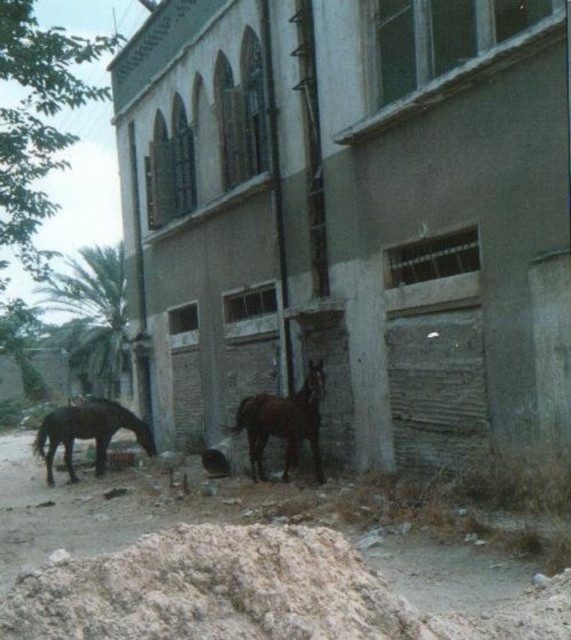
Question: Does brown glossy horse at center appear on the right side of shiny dark brown horse at lower left?

Choices:
 (A) no
 (B) yes

Answer: (B)

Question: Which object is the closest to the light brown sandy mound at lower center?

Choices:
 (A) shiny dark brown horse at lower left
 (B) brown dirt at lower center

Answer: (B)

Question: Which object is positioned closest to the shiny dark brown horse at lower left?

Choices:
 (A) brown dirt at lower center
 (B) light brown sandy mound at lower center

Answer: (A)

Question: Does light brown sandy mound at lower center come in front of brown glossy horse at center?

Choices:
 (A) yes
 (B) no

Answer: (A)

Question: Is brown dirt at lower center positioned behind shiny dark brown horse at lower left?

Choices:
 (A) yes
 (B) no

Answer: (B)

Question: Which of the following is the closest to the observer?

Choices:
 (A) shiny dark brown horse at lower left
 (B) brown dirt at lower center
 (C) light brown sandy mound at lower center

Answer: (C)